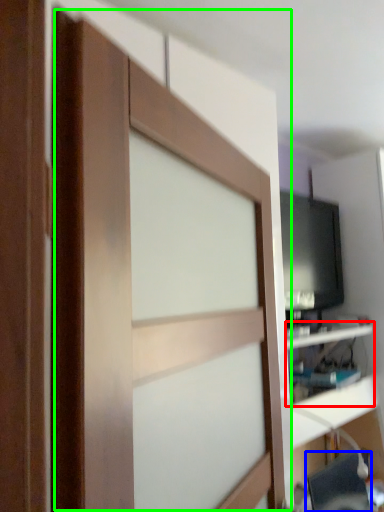
Question: Considering the real-world distances, which object is closest to shelf (highlighted by a red box)? computer chair (highlighted by a blue box) or barn door (highlighted by a green box).

Choices:
 (A) computer chair
 (B) barn door

Answer: (A)